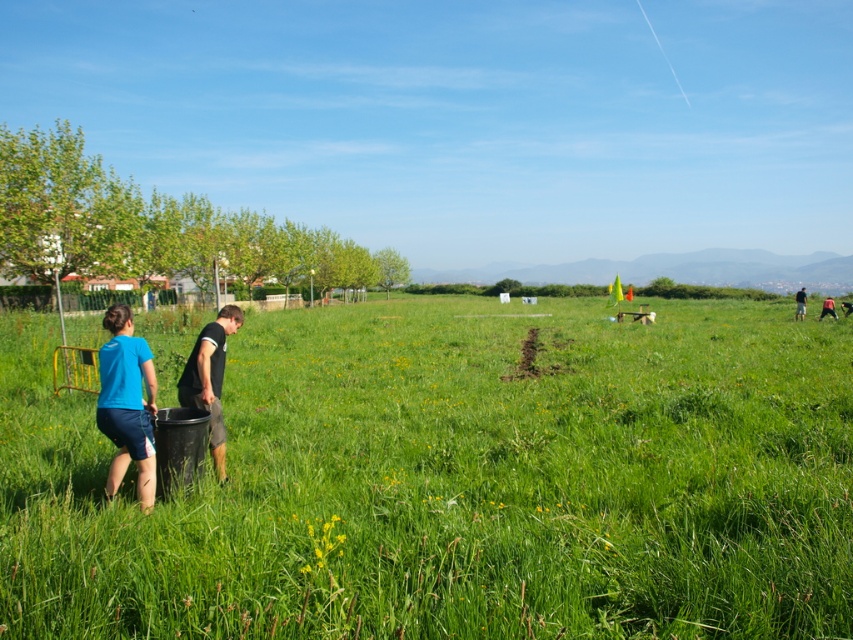
Question: Does green grass pasture at center have a lesser width compared to blurred green shirt at right?

Choices:
 (A) yes
 (B) no

Answer: (B)

Question: Based on their relative distances, which object is farther from the blurred green shirt at right?

Choices:
 (A) blue fabric couple at center
 (B) green grass pasture at center

Answer: (A)

Question: Can you confirm if green grass pasture at center is thinner than dark gray fabric pants at left?

Choices:
 (A) no
 (B) yes

Answer: (A)

Question: Considering the relative positions of green grass pasture at center and blurred green shirt at right in the image provided, where is green grass pasture at center located with respect to blurred green shirt at right?

Choices:
 (A) below
 (B) above

Answer: (A)

Question: Which point is closer to the camera taking this photo?

Choices:
 (A) (221, 349)
 (B) (134, 413)
 (C) (491, 358)

Answer: (B)

Question: Which point is farther to the camera?

Choices:
 (A) (805, 298)
 (B) (196, 394)

Answer: (A)